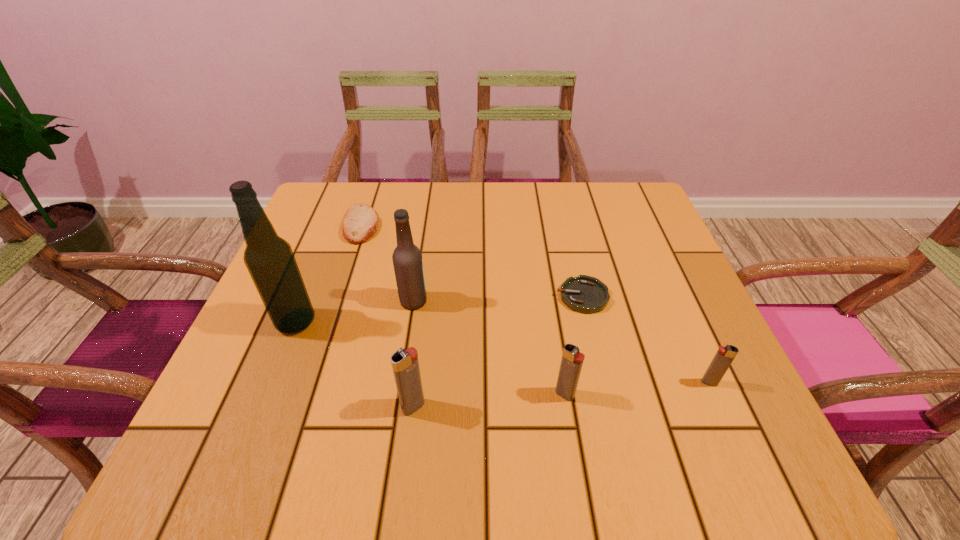
This screenshot has width=960, height=540. I want to click on the third tallest object, so click(405, 365).

Where is `the leftmost igniter`? The height and width of the screenshot is (540, 960). the leftmost igniter is located at coordinates pos(405,365).

In order to click on the second igniter from left to right in this screenshot , I will do `click(572, 360)`.

Identify the location of the second tallest igniter. The image size is (960, 540). (572, 360).

What are the coordinates of `the shortest igniter` in the screenshot? It's located at (723, 358).

Image resolution: width=960 pixels, height=540 pixels. Identify the location of the rightmost igniter. (723, 358).

Identify the location of pita bread. pos(361,222).

The height and width of the screenshot is (540, 960). Identify the location of the second shortest object. (361, 222).

The height and width of the screenshot is (540, 960). Find the location of `the sixth shortest object`. the sixth shortest object is located at coordinates (407, 259).

At what (x,y) coordinates should I click in order to perform the action: click on the second object from right to left. Please return your answer as a coordinate pair (x, y). This screenshot has width=960, height=540. Looking at the image, I should click on (585, 294).